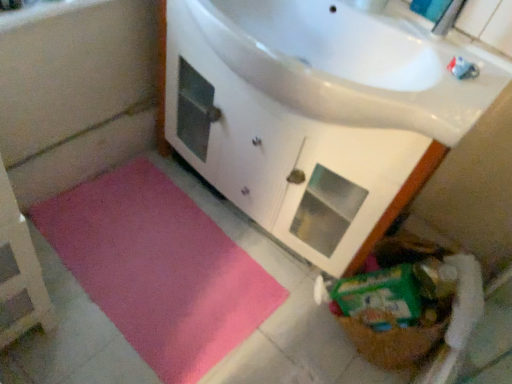
At what (x,y) coordinates should I click in order to perform the action: click on vacant space in pink fabric bath mat at lower left (from a real-world perspective). Please return your answer as a coordinate pair (x, y). The image size is (512, 384). Looking at the image, I should click on (94, 169).